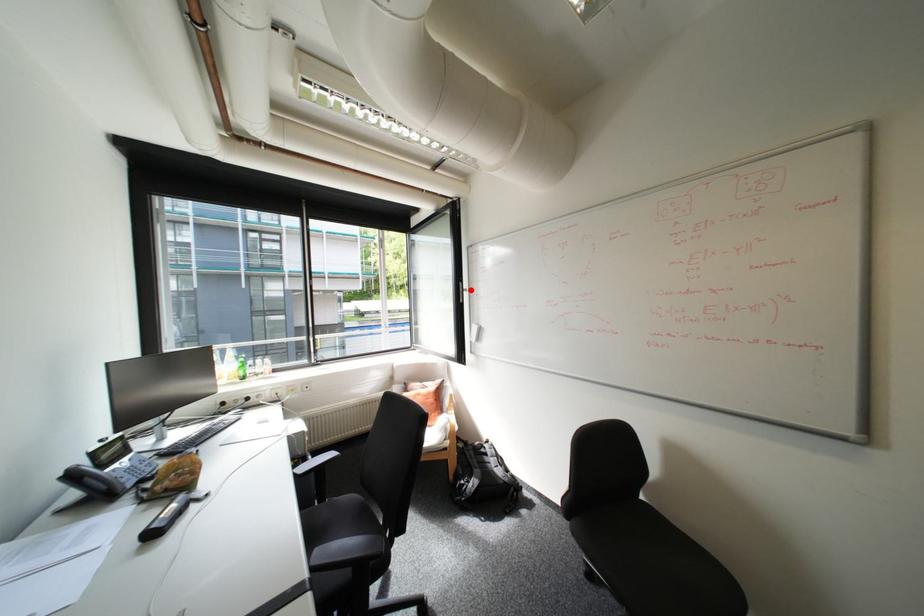
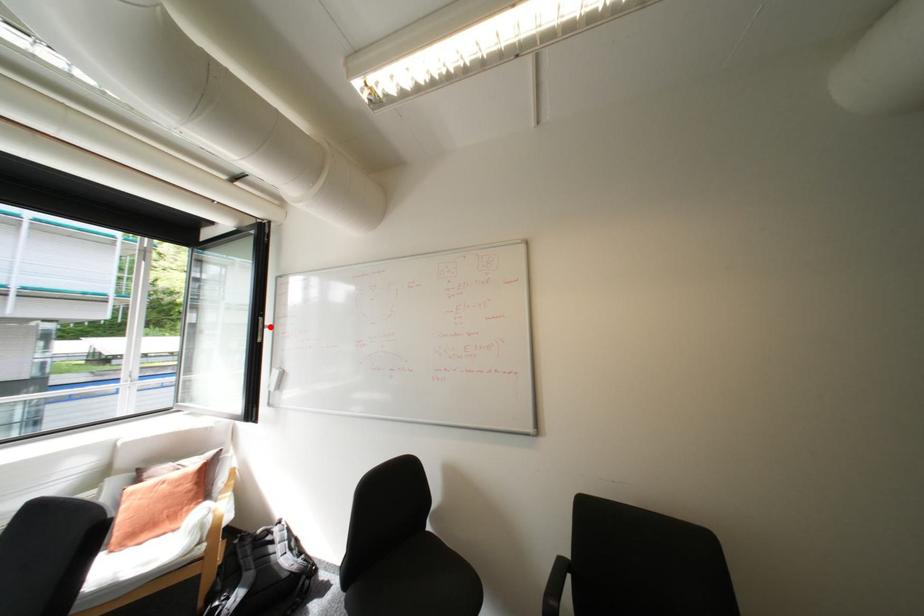
I am providing you with two images of the same scene from different viewpoints. A red point is marked on the first image and another point is marked on the second image. Do the highlighted points in image1 and image2 indicate the same real-world spot?

Yes